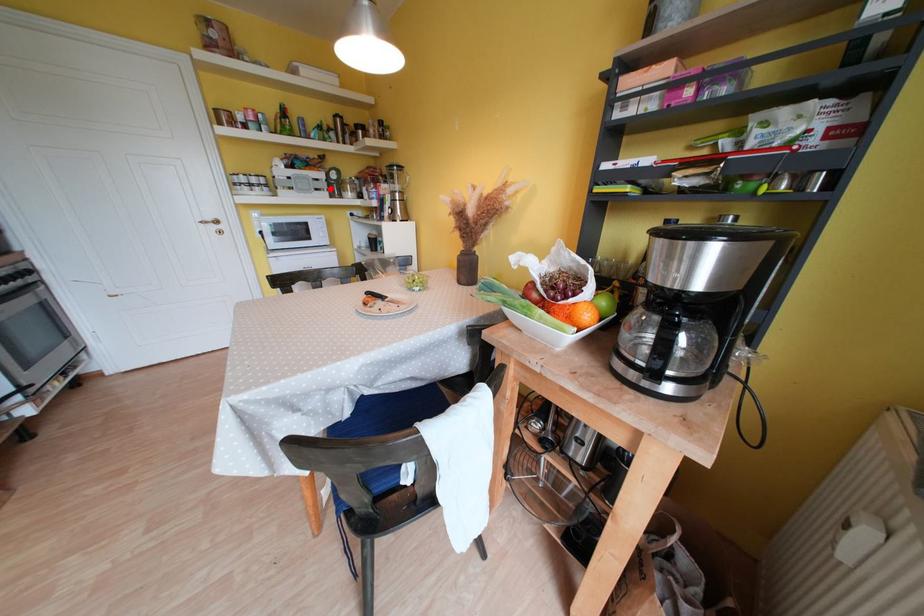
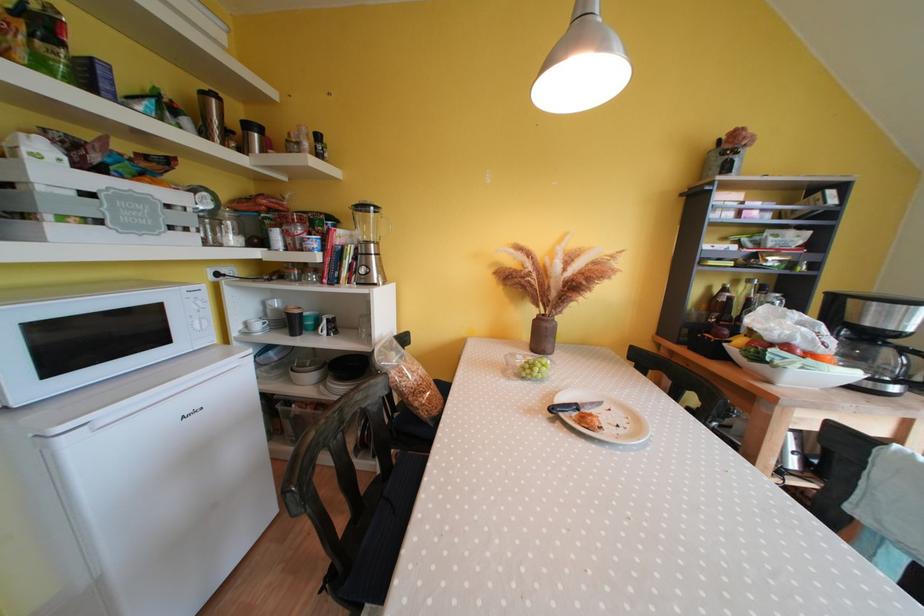
Question: I am providing you with two images of the same scene from different viewpoints. Given a red point in image1, look at the same physical point in image2. Is it:

Choices:
 (A) Closer to the viewpoint
 (B) Farther from the viewpoint

Answer: (B)